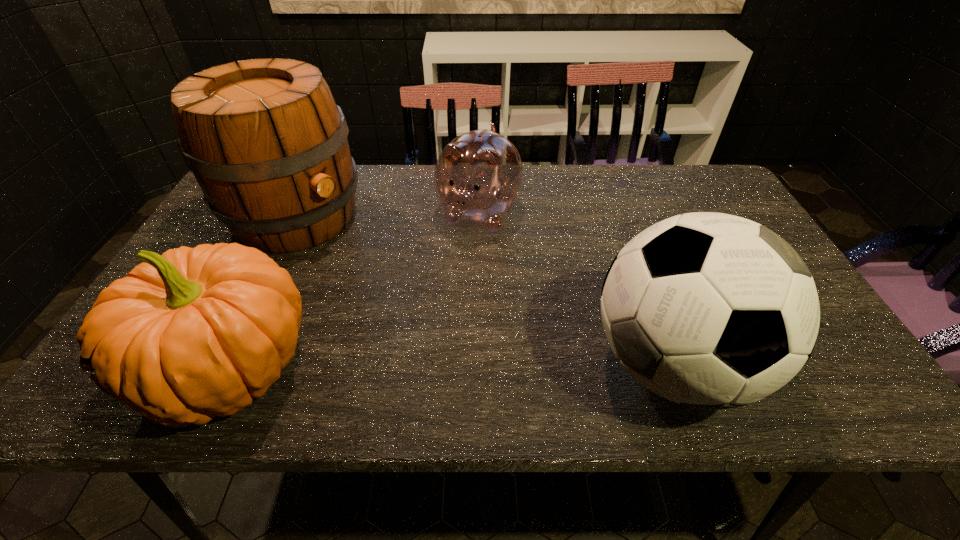
I want to click on vacant area between the piggy bank and the soccer ball, so click(x=575, y=288).

I want to click on vacant space in between the soccer ball and the cider, so point(484,290).

This screenshot has width=960, height=540. Find the location of `the closest object relative to the cider`. the closest object relative to the cider is located at coordinates (194, 333).

Identify the location of object that is the third closest to the rightmost object. (265, 140).

The image size is (960, 540). I want to click on vacant space that satisfies the following two spatial constraints: 1. on the front side of the rightmost object; 2. on the main logo of the cider, so click(225, 364).

The height and width of the screenshot is (540, 960). Find the location of `free point that satisfies the following two spatial constraints: 1. on the front side of the rightmost object; 2. on the main logo of the shortest object`. free point that satisfies the following two spatial constraints: 1. on the front side of the rightmost object; 2. on the main logo of the shortest object is located at coordinates (478, 364).

Where is `vacant space that satisfies the following two spatial constraints: 1. on the front side of the soccer ball; 2. on the main logo of the shortest object`? This screenshot has height=540, width=960. vacant space that satisfies the following two spatial constraints: 1. on the front side of the soccer ball; 2. on the main logo of the shortest object is located at coordinates (478, 364).